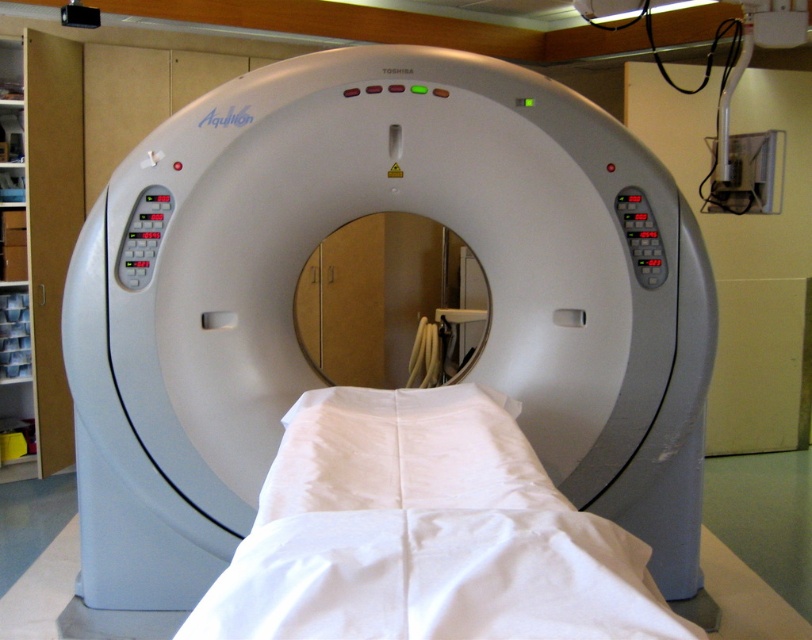
Question: Is white fabric bed at center below white smooth pillow at center?

Choices:
 (A) yes
 (B) no

Answer: (A)

Question: In this image, where is white fabric bed at center located relative to white smooth pillow at center?

Choices:
 (A) above
 (B) below

Answer: (B)

Question: Considering the relative positions of white fabric bed at center and white smooth pillow at center in the image provided, where is white fabric bed at center located with respect to white smooth pillow at center?

Choices:
 (A) left
 (B) right

Answer: (B)

Question: Among these objects, which one is nearest to the camera?

Choices:
 (A) white fabric bed at center
 (B) white smooth pillow at center

Answer: (A)

Question: Among these points, which one is nearest to the camera?

Choices:
 (A) (452, 544)
 (B) (274, 460)

Answer: (A)